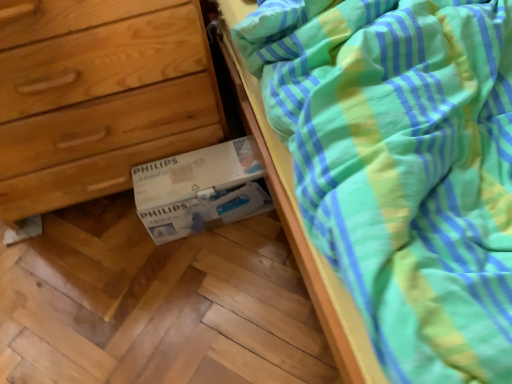
Question: Relative to wooden chest of drawers at lower left, is white cardboard box at lower center in front or behind?

Choices:
 (A) behind
 (B) front

Answer: (A)

Question: Would you say white cardboard box at lower center is inside or outside wooden chest of drawers at lower left?

Choices:
 (A) outside
 (B) inside

Answer: (A)

Question: From a real-world perspective, relative to wooden chest of drawers at lower left, is white cardboard box at lower center vertically above or below?

Choices:
 (A) below
 (B) above

Answer: (A)

Question: Is point (181, 33) closer or farther from the camera than point (212, 170)?

Choices:
 (A) closer
 (B) farther

Answer: (A)

Question: From a real-world perspective, is wooden chest of drawers at lower left positioned above or below white cardboard box at lower center?

Choices:
 (A) above
 (B) below

Answer: (A)

Question: Is wooden chest of drawers at lower left in front of or behind white cardboard box at lower center in the image?

Choices:
 (A) front
 (B) behind

Answer: (A)

Question: From the image's perspective, relative to white cardboard box at lower center, is wooden chest of drawers at lower left above or below?

Choices:
 (A) above
 (B) below

Answer: (A)